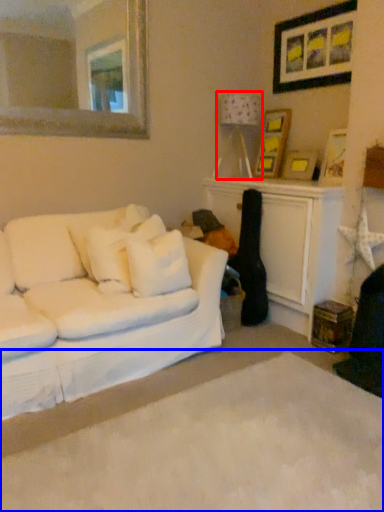
Question: Which point is closer to the camera, lamp (highlighted by a red box) or plain (highlighted by a blue box)?

Choices:
 (A) lamp
 (B) plain

Answer: (B)